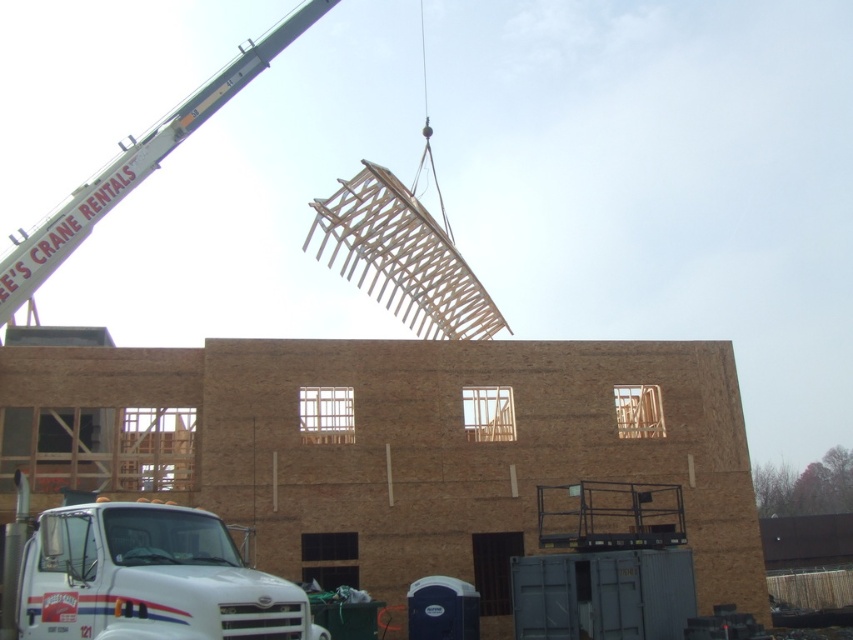
Which of these two, white glossy truck at lower left or white painted metal crane at upper left, stands shorter?

white glossy truck at lower left is shorter.

Can you confirm if white glossy truck at lower left is taller than white painted metal crane at upper left?

No.

Locate an element on the screen. This screenshot has width=853, height=640. white glossy truck at lower left is located at coordinates (144, 579).

Identify the location of white glossy truck at lower left. (144, 579).